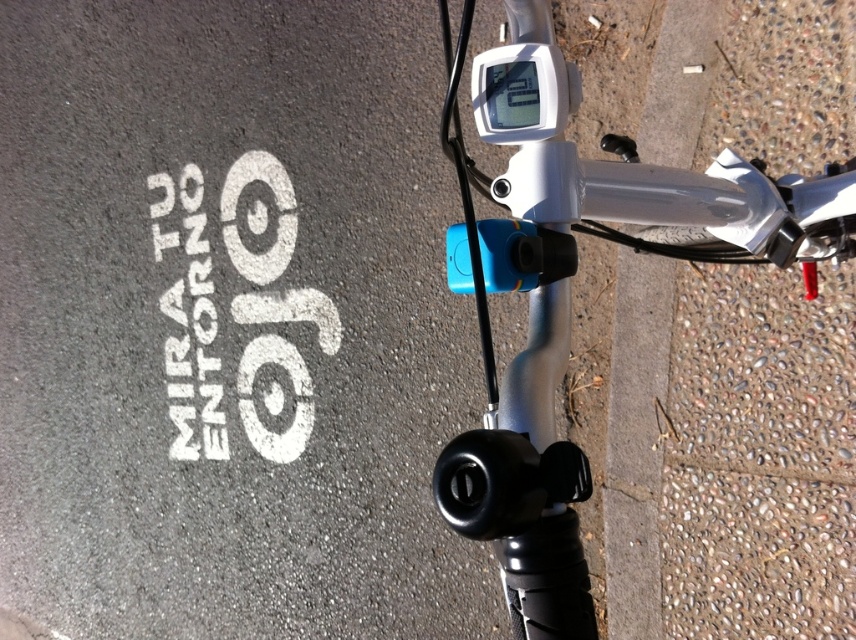
Question: Can you confirm if silver metallic bicycle handlebar at center is wider than white painted text at lower left?

Choices:
 (A) yes
 (B) no

Answer: (B)

Question: Which point appears closest to the camera in this image?

Choices:
 (A) (189, 205)
 (B) (580, 637)

Answer: (B)

Question: Can you confirm if silver metallic bicycle handlebar at center is positioned below white painted text at lower left?

Choices:
 (A) no
 (B) yes

Answer: (B)

Question: Which point is farther to the camera?

Choices:
 (A) (334, 328)
 (B) (545, 547)

Answer: (A)

Question: Which point is closer to the camera?

Choices:
 (A) silver metallic bicycle handlebar at center
 (B) white painted text at lower left

Answer: (A)

Question: Can you confirm if silver metallic bicycle handlebar at center is bigger than white painted text at lower left?

Choices:
 (A) yes
 (B) no

Answer: (B)